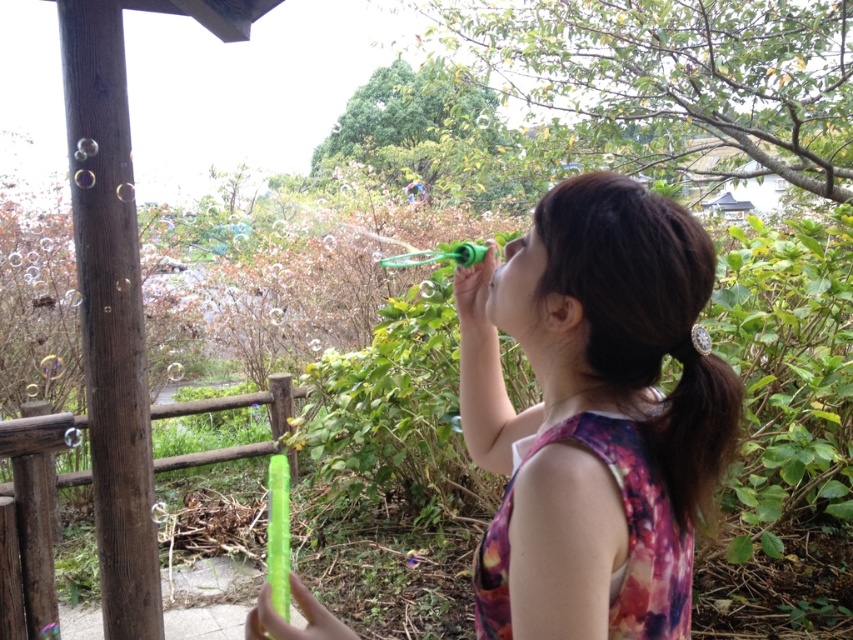
Question: Can you confirm if matte green bubble wand at center is thinner than green plastic rail at center?

Choices:
 (A) yes
 (B) no

Answer: (A)

Question: Does matte green bubble wand at center come in front of brown wood pole at left?

Choices:
 (A) yes
 (B) no

Answer: (A)

Question: From the image, what is the correct spatial relationship of matte green bubble wand at center in relation to brown silky hair at upper right?

Choices:
 (A) below
 (B) above

Answer: (A)

Question: Which of the following is the closest to the observer?

Choices:
 (A) (587, 426)
 (B) (44, 490)
 (C) (113, 58)

Answer: (A)

Question: Which point is farther to the camera?

Choices:
 (A) green plastic rail at center
 (B) brown silky hair at upper right
 (C) brown wood pole at left
 (D) matte green bubble wand at center

Answer: (A)

Question: Which of the following is the farthest from the observer?

Choices:
 (A) brown wood pole at left
 (B) brown silky hair at upper right
 (C) matte green bubble wand at center

Answer: (A)